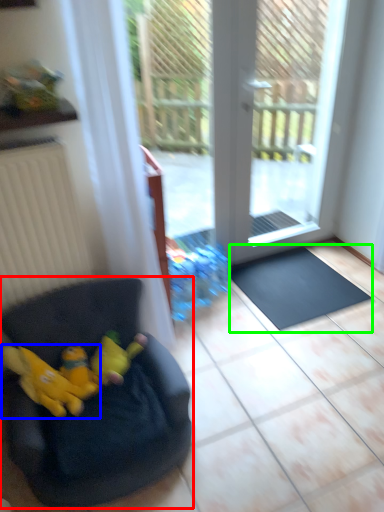
Question: Which object is positioned closest to chair (highlighted by a red box)? Select from animal (highlighted by a blue box) and doormat (highlighted by a green box).

Choices:
 (A) animal
 (B) doormat

Answer: (A)